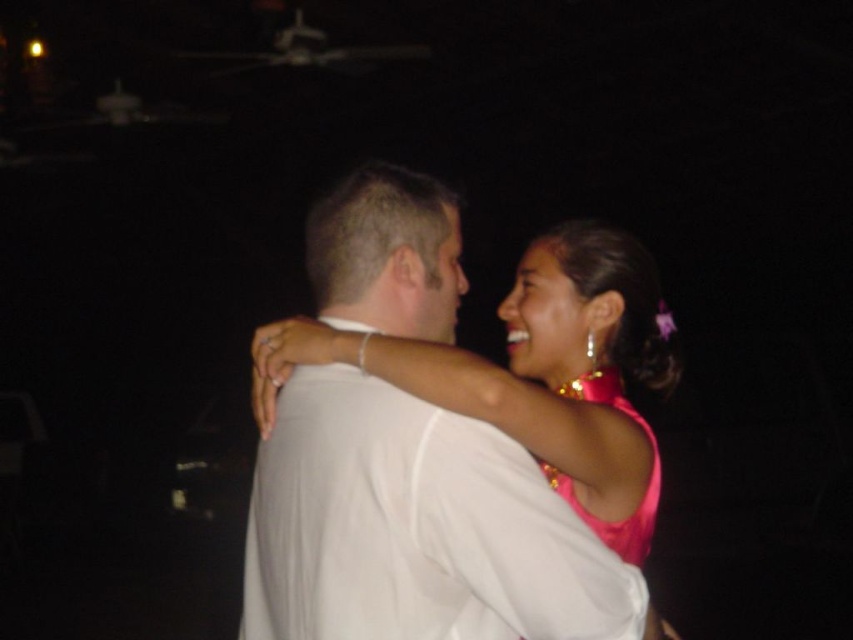
Is pink satin dress at center positioned at the back of pink satin dress at upper right?

No, it is in front of pink satin dress at upper right.

Is pink satin dress at center smaller than pink satin dress at upper right?

No, pink satin dress at center is not smaller than pink satin dress at upper right.

Between point (445, 211) and point (616, 522), which one is positioned behind?

Positioned behind is point (616, 522).

In order to click on pink satin dress at center in this screenshot , I will do `click(418, 528)`.